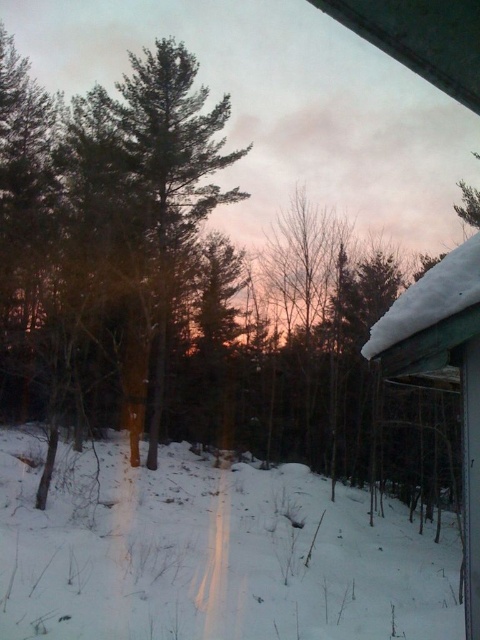
You are standing at the edge of the winter scene and notice a point marked at coordinates (211, 554). What is located at that point?

The point at coordinates (211, 554) indicates white fluffy snow at center.